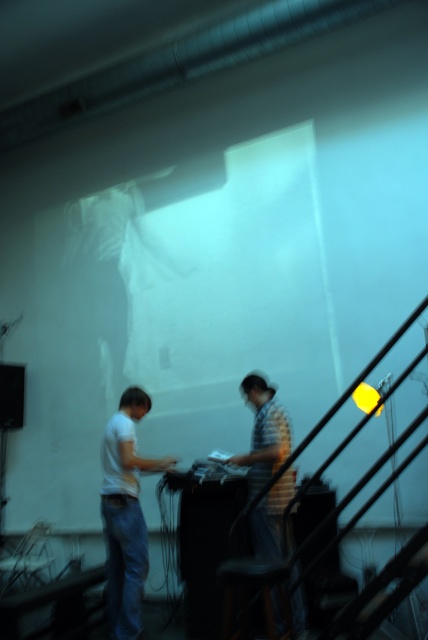
You are a photographer setting up for a photoshoot in a dimly lit room. You notice two subjects wearing a white matte shirt at left and a striped cotton shirt at center. The camera you are using has a focal length of 50mm and an aperture of f2.8. To ensure both subjects are in focus, what is the minimum distance you should stand from them while maintaining their current positions?

The subjects are 28.60 inches apart. To ensure both are in focus with a 50mm lens at f2.8, the minimum distance should be calculated using the hyperfocal distance formula. However, a simpler approach is to focus approximately one third of the distance from the nearest subject. Thus, positioning the camera at least 42.9 inches away would help keep both the white matte shirt at left and striped cotton shirt at center in focus.

You are a photographer positioned behind the dark brown wooden stool at lower center and want to take a photo of the white matte shirt at left. Will the stool block your view of the shirt?

The white matte shirt at left is further to the viewer than the dark brown wooden stool at lower center, so the stool will not block your view of the shirt since the shirt is closer to you.